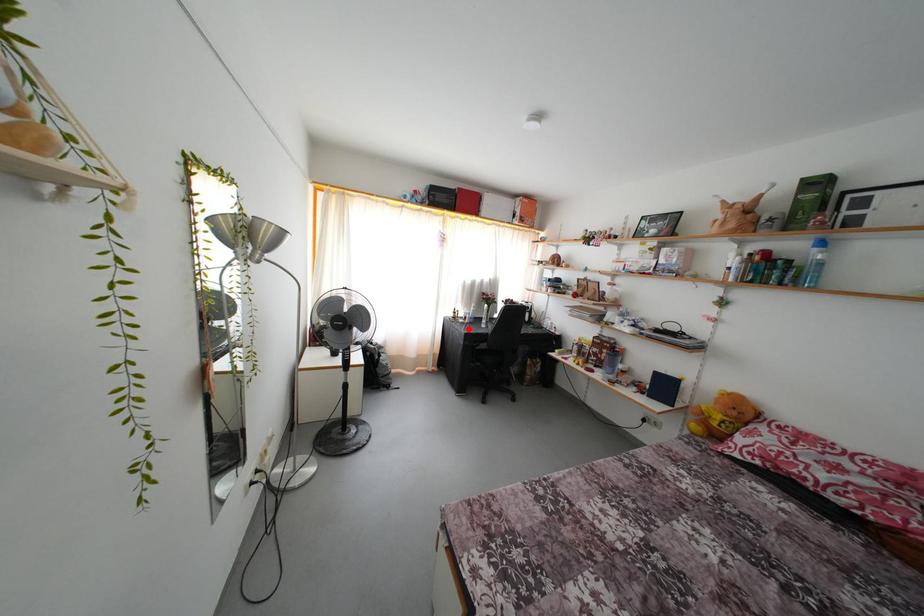
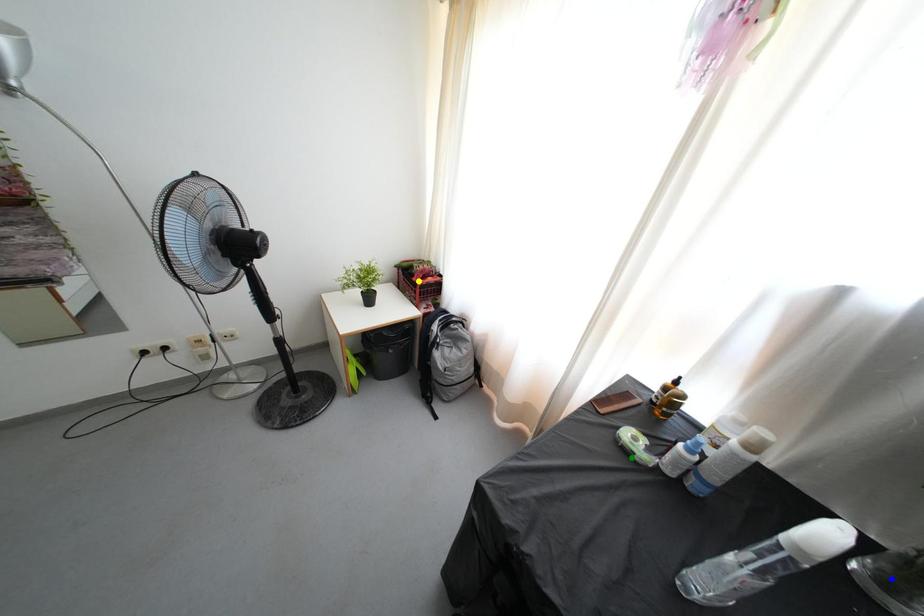
Question: I am providing you with two images of the same scene from different viewpoints. A red point is marked on the first image. You are given multiple points on the second image. Which spot in image 2 lines up with the point in image 1?

Choices:
 (A) green point
 (B) yellow point
 (C) blue point

Answer: (A)